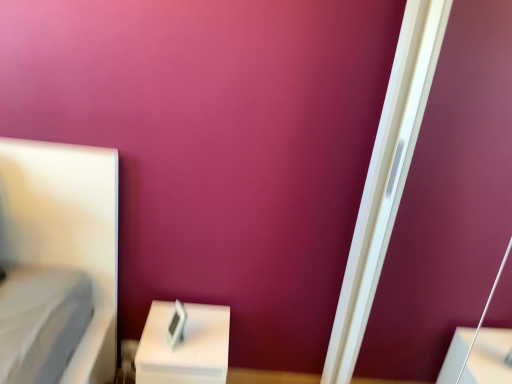
The height and width of the screenshot is (384, 512). What do you see at coordinates (386, 178) in the screenshot?
I see `white glossy screen door at right` at bounding box center [386, 178].

This screenshot has width=512, height=384. In order to click on white glossy screen door at right in this screenshot , I will do `click(386, 178)`.

You are a GUI agent. You are given a task and a screenshot of the screen. Output one action in this format:
    pyautogui.click(x=<x>, y=<y>)
    Task: Click on the white plastic clock at lower center
    This screenshot has width=512, height=384.
    Given the screenshot: What is the action you would take?
    pyautogui.click(x=184, y=346)

Describe the element at coordinates (184, 346) in the screenshot. I see `white plastic clock at lower center` at that location.

You are a GUI agent. You are given a task and a screenshot of the screen. Output one action in this format:
    pyautogui.click(x=<x>, y=<y>)
    Task: Click on the white glossy screen door at right
    
    Given the screenshot: What is the action you would take?
    pyautogui.click(x=386, y=178)

Considering the positions of objects white plastic clock at lower center and white glossy screen door at right in the image provided, who is more to the right, white plastic clock at lower center or white glossy screen door at right?

white glossy screen door at right is more to the right.

Is white plastic clock at lower center further to the viewer compared to white glossy screen door at right?

Yes, white plastic clock at lower center is behind white glossy screen door at right.

Which is closer, (167, 308) or (407, 43)?

Positioned in front is point (407, 43).

From the image's perspective, which object appears higher, white plastic clock at lower center or white glossy screen door at right?

white glossy screen door at right, from the image's perspective.

From a real-world perspective, which is physically above, white plastic clock at lower center or white glossy screen door at right?

white glossy screen door at right.

Can you confirm if white plastic clock at lower center is wider than white glossy screen door at right?

Yes.

Is white plastic clock at lower center shorter than white glossy screen door at right?

Indeed, white plastic clock at lower center has a lesser height compared to white glossy screen door at right.

Can you confirm if white plastic clock at lower center is smaller than white glossy screen door at right?

Yes, white plastic clock at lower center is smaller than white glossy screen door at right.

From the picture: Could white glossy screen door at right be considered to be inside white plastic clock at lower center?

No, white glossy screen door at right is not surrounded by white plastic clock at lower center.

Is white plastic clock at lower center far from white glossy screen door at right?

No.

Is white plastic clock at lower center looking in the opposite direction of white glossy screen door at right?

No.

What's the angular difference between white plastic clock at lower center and white glossy screen door at right's facing directions?

They differ by 90.1 degrees in their facing directions.

Image resolution: width=512 pixels, height=384 pixels. In the image, there is a white plastic clock at lower center. What are the coordinates of `screen door above it (from the image's perspective)` in the screenshot? It's located at (386, 178).

Which object is positioned more to the right, white glossy screen door at right or white plastic clock at lower center?

white glossy screen door at right.

Is white glossy screen door at right in front of or behind white plastic clock at lower center in the image?

white glossy screen door at right is in front of white plastic clock at lower center.

Which is closer, (400, 201) or (165, 311)?

Point (400, 201) is positioned closer to the camera compared to point (165, 311).

From the image's perspective, is white glossy screen door at right on top of white plastic clock at lower center?

Yes.

From a real-world perspective, is white glossy screen door at right positioned above or below white plastic clock at lower center?

From a real-world perspective, white glossy screen door at right is physically above white plastic clock at lower center.

Considering the sizes of objects white glossy screen door at right and white plastic clock at lower center in the image provided, who is thinner, white glossy screen door at right or white plastic clock at lower center?

white glossy screen door at right.

Considering the sizes of white glossy screen door at right and white plastic clock at lower center in the image, is white glossy screen door at right taller or shorter than white plastic clock at lower center?

Clearly, white glossy screen door at right is taller compared to white plastic clock at lower center.

Does white glossy screen door at right have a smaller size compared to white plastic clock at lower center?

No.

Is white glossy screen door at right not inside white plastic clock at lower center?

white glossy screen door at right lies outside white plastic clock at lower center's area.

Is white glossy screen door at right far away from white plastic clock at lower center?

No, white glossy screen door at right is not far away from white plastic clock at lower center.

Is white glossy screen door at right facing towards white plastic clock at lower center?

Yes, white glossy screen door at right is aimed at white plastic clock at lower center.

How many degrees apart are the facing directions of white glossy screen door at right and white plastic clock at lower center?

white glossy screen door at right and white plastic clock at lower center are facing 90.1 degrees away from each other.

You are a GUI agent. You are given a task and a screenshot of the screen. Output one action in this format:
    pyautogui.click(x=<x>, y=<y>)
    Task: Click on the furniture located underneath the white glossy screen door at right (from a real-world perspective)
    The width and height of the screenshot is (512, 384).
    Given the screenshot: What is the action you would take?
    pyautogui.click(x=184, y=346)

You are a GUI agent. You are given a task and a screenshot of the screen. Output one action in this format:
    pyautogui.click(x=<x>, y=<y>)
    Task: Click on the screen door in front of the white plastic clock at lower center
    The image size is (512, 384).
    Given the screenshot: What is the action you would take?
    pyautogui.click(x=386, y=178)

Identify the location of furniture behind the white glossy screen door at right. This screenshot has width=512, height=384. (184, 346).